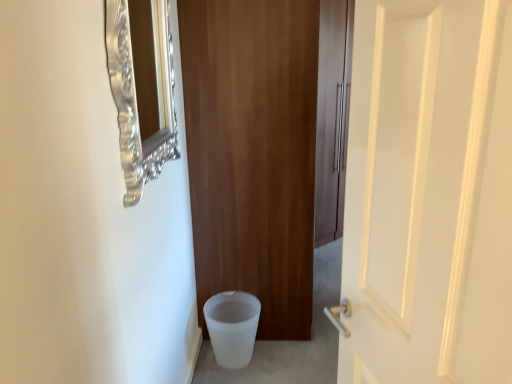
Where is `white frosted potty at lower left`? The width and height of the screenshot is (512, 384). white frosted potty at lower left is located at coordinates (232, 326).

Identify the location of white frosted potty at lower left. The image size is (512, 384). (232, 326).

From a real-world perspective, between wooden door at center, the 2th door viewed from the front, and silver ornate mirror at upper left, who is vertically lower?

From a 3D spatial view, wooden door at center, the 2th door viewed from the front, is below.

Which of these two, wooden door at center, the 1th door viewed from the back, or silver ornate mirror at upper left, is wider?

wooden door at center, the 1th door viewed from the back, is wider.

How far apart are wooden door at center, the 1th door viewed from the back, and silver ornate mirror at upper left?

A distance of 19.51 inches exists between wooden door at center, the 1th door viewed from the back, and silver ornate mirror at upper left.

In the scene shown: Is wooden door at center, the 1th door viewed from the back, oriented away from silver ornate mirror at upper left?

No.

From a real-world perspective, is wooden door at center, the 1th door viewed from the back, over white glossy door at right, the 2th door viewed from the back?

No.

Which object is more forward, wooden door at center, the 2th door viewed from the front, or white glossy door at right, the first door viewed from the front?

Positioned in front is white glossy door at right, the first door viewed from the front.

Is wooden door at center, the 1th door viewed from the back, taller than white glossy door at right, the first door viewed from the front?

Indeed, wooden door at center, the 1th door viewed from the back, has a greater height compared to white glossy door at right, the first door viewed from the front.

From the image's perspective, does wooden door at center, the 1th door viewed from the back, appear higher than white glossy door at right, the 2th door viewed from the back?

Yes, from the image's perspective, wooden door at center, the 1th door viewed from the back, is above white glossy door at right, the 2th door viewed from the back.

Would you consider white glossy door at right, the first door viewed from the front, to be distant from wooden door at center, the 1th door viewed from the back?

white glossy door at right, the first door viewed from the front, is positioned a significant distance from wooden door at center, the 1th door viewed from the back.

You are a GUI agent. You are given a task and a screenshot of the screen. Output one action in this format:
    pyautogui.click(x=<x>, y=<y>)
    Task: Click on the door in front of the wooden door at center, the 2th door viewed from the front
    This screenshot has width=512, height=384.
    Given the screenshot: What is the action you would take?
    pyautogui.click(x=429, y=194)

Considering the positions of objects white glossy door at right, the first door viewed from the front, and wooden door at center, the 2th door viewed from the front, in the image provided, who is in front, white glossy door at right, the first door viewed from the front, or wooden door at center, the 2th door viewed from the front,?

white glossy door at right, the first door viewed from the front, is more forward.

Looking at the image, does white glossy door at right, the 2th door viewed from the back, seem bigger or smaller compared to wooden door at center, the 1th door viewed from the back?

In the image, white glossy door at right, the 2th door viewed from the back, appears to be smaller than wooden door at center, the 1th door viewed from the back.

Is silver ornate mirror at upper left oriented towards white frosted potty at lower left?

No, silver ornate mirror at upper left is not aimed at white frosted potty at lower left.

Considering the sizes of silver ornate mirror at upper left and white frosted potty at lower left in the image, is silver ornate mirror at upper left wider or thinner than white frosted potty at lower left?

In the image, silver ornate mirror at upper left appears to be more narrow than white frosted potty at lower left.

Identify the location of potty behind the silver ornate mirror at upper left. The image size is (512, 384). (232, 326).

Who is taller, white frosted potty at lower left or white glossy door at right, the 2th door viewed from the back?

white glossy door at right, the 2th door viewed from the back.

From the picture: Between white frosted potty at lower left and white glossy door at right, the 2th door viewed from the back, which one has smaller width?

With smaller width is white glossy door at right, the 2th door viewed from the back.

Is white glossy door at right, the first door viewed from the front, at the back of white frosted potty at lower left?

No, white frosted potty at lower left is not facing away from white glossy door at right, the first door viewed from the front.

From the image's perspective, is white glossy door at right, the first door viewed from the front, located above silver ornate mirror at upper left?

No.

Is white glossy door at right, the 2th door viewed from the back, not near silver ornate mirror at upper left?

They are positioned close to each other.

Is white glossy door at right, the first door viewed from the front, to the left of silver ornate mirror at upper left from the viewer's perspective?

Incorrect, white glossy door at right, the first door viewed from the front, is not on the left side of silver ornate mirror at upper left.

Looking at this image, from a real-world perspective, which is physically below, white glossy door at right, the 2th door viewed from the back, or silver ornate mirror at upper left?

white glossy door at right, the 2th door viewed from the back, from a real-world perspective.

Is white frosted potty at lower left to the left of wooden door at center, the 2th door viewed from the front, from the viewer's perspective?

Yes.

Based on the photo, considering the sizes of objects white frosted potty at lower left and wooden door at center, the 1th door viewed from the back, in the image provided, who is wider, white frosted potty at lower left or wooden door at center, the 1th door viewed from the back,?

wooden door at center, the 1th door viewed from the back, is wider.

Would you say white frosted potty at lower left is a long distance from wooden door at center, the 1th door viewed from the back?

No, white frosted potty at lower left is not far away from wooden door at center, the 1th door viewed from the back.

Which is closer to the camera, (245, 341) or (206, 160)?

Point (206, 160)

This screenshot has width=512, height=384. What are the coordinates of `door above the silver ornate mirror at upper left (from the image's perspective)` in the screenshot? It's located at [x=252, y=153].

Find the location of a particular element. The height and width of the screenshot is (384, 512). door in front of the wooden door at center, the 2th door viewed from the front is located at coordinates (429, 194).

Considering their positions, is white frosted potty at lower left positioned closer to silver ornate mirror at upper left than white glossy door at right, the first door viewed from the front?

white glossy door at right, the first door viewed from the front, is positioned closer to the anchor silver ornate mirror at upper left.

From the image, which object appears to be farther from silver ornate mirror at upper left, white glossy door at right, the 2th door viewed from the back, or white frosted potty at lower left?

white frosted potty at lower left is positioned further to the anchor silver ornate mirror at upper left.

From the image, which object appears to be farther from wooden door at center, the 2th door viewed from the front, white frosted potty at lower left or silver ornate mirror at upper left?

Based on the image, silver ornate mirror at upper left appears to be further to wooden door at center, the 2th door viewed from the front.

Considering their positions, is white frosted potty at lower left positioned closer to white glossy door at right, the 2th door viewed from the back, than wooden door at center, the 2th door viewed from the front?

The object closer to white glossy door at right, the 2th door viewed from the back, is wooden door at center, the 2th door viewed from the front.

When comparing their distances from wooden door at center, the 2th door viewed from the front, does silver ornate mirror at upper left or white glossy door at right, the first door viewed from the front, seem further?

Among the two, white glossy door at right, the first door viewed from the front, is located further to wooden door at center, the 2th door viewed from the front.

From the image, which object appears to be farther from white frosted potty at lower left, wooden door at center, the 2th door viewed from the front, or white glossy door at right, the 2th door viewed from the back?

Based on the image, white glossy door at right, the 2th door viewed from the back, appears to be further to white frosted potty at lower left.

Estimate the real-world distances between objects in this image. Which object is closer to white glossy door at right, the first door viewed from the front, white frosted potty at lower left or silver ornate mirror at upper left?

silver ornate mirror at upper left lies closer to white glossy door at right, the first door viewed from the front, than the other object.

When comparing their distances from white glossy door at right, the 2th door viewed from the back, does wooden door at center, the 2th door viewed from the front, or white frosted potty at lower left seem closer?

wooden door at center, the 2th door viewed from the front, lies closer to white glossy door at right, the 2th door viewed from the back, than the other object.

At what (x,y) coordinates should I click in order to perform the action: click on medicine cabinet between white glossy door at right, the 2th door viewed from the back, and white frosted potty at lower left, along the z-axis. Please return your answer as a coordinate pair (x, y). The image size is (512, 384). Looking at the image, I should click on pos(141,89).

I want to click on medicine cabinet between white glossy door at right, the first door viewed from the front, and wooden door at center, the 1th door viewed from the back, along the z-axis, so click(141, 89).

Find the location of `medicine cabinet between wooden door at center, the 2th door viewed from the front, and white frosted potty at lower left from top to bottom`. medicine cabinet between wooden door at center, the 2th door viewed from the front, and white frosted potty at lower left from top to bottom is located at coordinates (141, 89).

At what (x,y) coordinates should I click in order to perform the action: click on door between white glossy door at right, the first door viewed from the front, and white frosted potty at lower left in the front-back direction. Please return your answer as a coordinate pair (x, y). The height and width of the screenshot is (384, 512). Looking at the image, I should click on (252, 153).